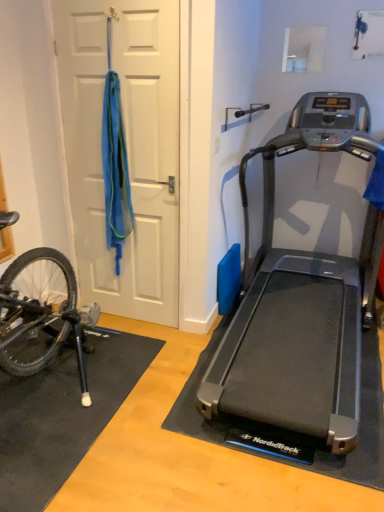
Question: Is there a large distance between white matte door at left and black rubber doormat at lower left?

Choices:
 (A) no
 (B) yes

Answer: (B)

Question: From a real-world perspective, does white matte door at left sit lower than black rubber doormat at lower left?

Choices:
 (A) no
 (B) yes

Answer: (A)

Question: From the image's perspective, is white matte door at left under black rubber doormat at lower left?

Choices:
 (A) no
 (B) yes

Answer: (A)

Question: Is white matte door at left behind black rubber doormat at lower left?

Choices:
 (A) yes
 (B) no

Answer: (A)

Question: Is white matte door at left placed right next to black rubber doormat at lower left?

Choices:
 (A) yes
 (B) no

Answer: (B)

Question: Is black rubber doormat at lower left bigger or smaller than silver metallic treadmill at right?

Choices:
 (A) big
 (B) small

Answer: (B)

Question: Is black rubber doormat at lower left to the left or to the right of silver metallic treadmill at right in the image?

Choices:
 (A) right
 (B) left

Answer: (B)

Question: From the image's perspective, relative to silver metallic treadmill at right, is black rubber doormat at lower left above or below?

Choices:
 (A) above
 (B) below

Answer: (B)

Question: From a real-world perspective, is black rubber doormat at lower left physically located above or below silver metallic treadmill at right?

Choices:
 (A) above
 (B) below

Answer: (B)

Question: Is silver metallic treadmill at right to the left or to the right of white matte door at left in the image?

Choices:
 (A) left
 (B) right

Answer: (B)

Question: In terms of height, does silver metallic treadmill at right look taller or shorter compared to white matte door at left?

Choices:
 (A) short
 (B) tall

Answer: (A)

Question: From a real-world perspective, is silver metallic treadmill at right above or below white matte door at left?

Choices:
 (A) below
 (B) above

Answer: (A)

Question: Considering the positions of silver metallic treadmill at right and white matte door at left in the image, is silver metallic treadmill at right wider or thinner than white matte door at left?

Choices:
 (A) wide
 (B) thin

Answer: (A)

Question: From the image's perspective, is black matte bicycle at lower left located above or below silver metallic treadmill at right?

Choices:
 (A) above
 (B) below

Answer: (B)

Question: Looking at the image, does black matte bicycle at lower left seem bigger or smaller compared to silver metallic treadmill at right?

Choices:
 (A) big
 (B) small

Answer: (B)